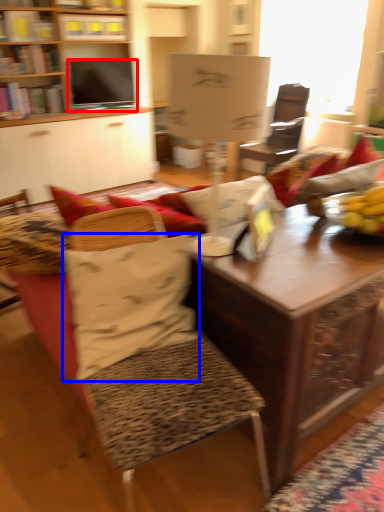
Question: Which point is further to the camera, television (highlighted by a red box) or pillow (highlighted by a blue box)?

Choices:
 (A) television
 (B) pillow

Answer: (A)